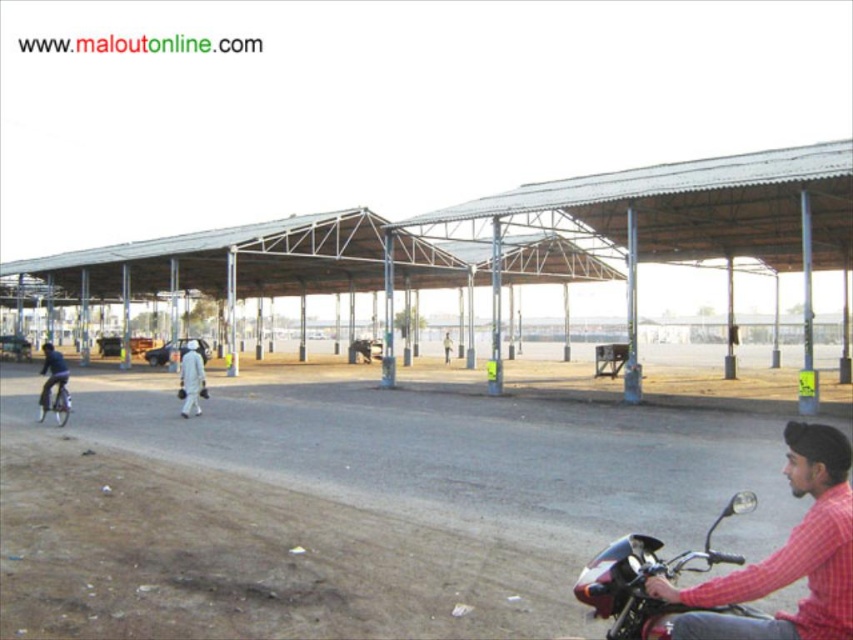
Question: Which object is positioned farthest from the white matte person at center?

Choices:
 (A) dark blue jacket at left
 (B) shiny black motorcycle at lower right

Answer: (B)

Question: Is white matte clothing at center to the right of white matte person at center from the viewer's perspective?

Choices:
 (A) no
 (B) yes

Answer: (A)

Question: Which of these objects is positioned closest to the white matte person at center?

Choices:
 (A) shiny metallic bicycle at left
 (B) red checkered shirt at lower right
 (C) white matte clothing at center

Answer: (C)

Question: Can you confirm if white matte clothing at center is smaller than white matte person at center?

Choices:
 (A) no
 (B) yes

Answer: (A)

Question: Does shiny black motorcycle at lower right appear on the right side of white matte clothing at center?

Choices:
 (A) yes
 (B) no

Answer: (A)

Question: Among these points, which one is farthest from the camera?

Choices:
 (A) (448, 333)
 (B) (38, 403)
 (C) (694, 605)
 (D) (181, 404)

Answer: (A)